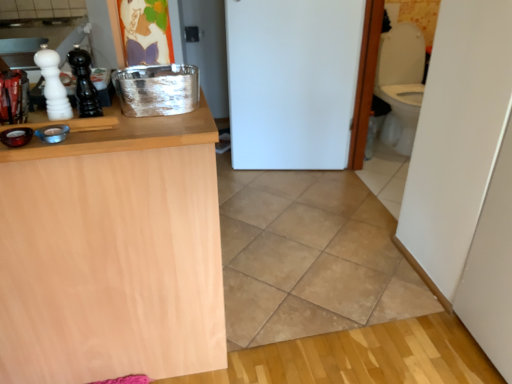
At what (x,y) coordinates should I click in order to perform the action: click on light wood cabinet at left. Please return your answer as a coordinate pair (x, y). This screenshot has height=384, width=512. Looking at the image, I should click on (112, 253).

The height and width of the screenshot is (384, 512). What do you see at coordinates (112, 253) in the screenshot?
I see `light wood cabinet at left` at bounding box center [112, 253].

Image resolution: width=512 pixels, height=384 pixels. What are the coordinates of `light wood cabinet at left` in the screenshot? It's located at (112, 253).